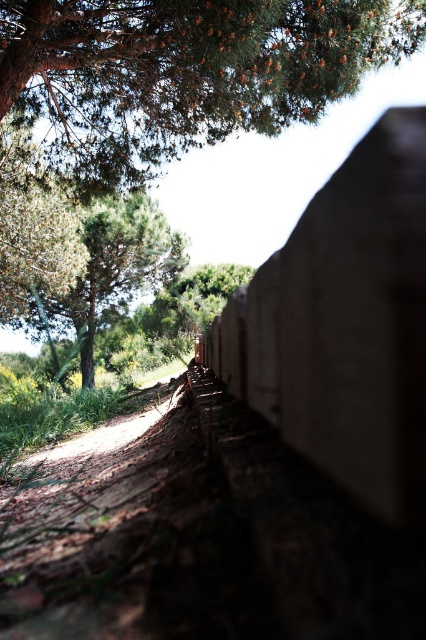
Question: Among these points, which one is nearest to the camera?

Choices:
 (A) (65, 321)
 (B) (138, 99)

Answer: (B)

Question: Among these objects, which one is nearest to the camera?

Choices:
 (A) green leafy tree at upper left
 (B) green textured pine tree at upper left

Answer: (B)

Question: Is green textured pine tree at upper left further to camera compared to green leafy tree at upper left?

Choices:
 (A) yes
 (B) no

Answer: (B)

Question: Is green textured pine tree at upper left to the left of green leafy tree at upper left from the viewer's perspective?

Choices:
 (A) no
 (B) yes

Answer: (A)

Question: Does green textured pine tree at upper left appear on the left side of green leafy tree at upper left?

Choices:
 (A) no
 (B) yes

Answer: (A)

Question: Which object appears farthest from the camera in this image?

Choices:
 (A) green leafy tree at upper left
 (B) green textured pine tree at upper left

Answer: (A)